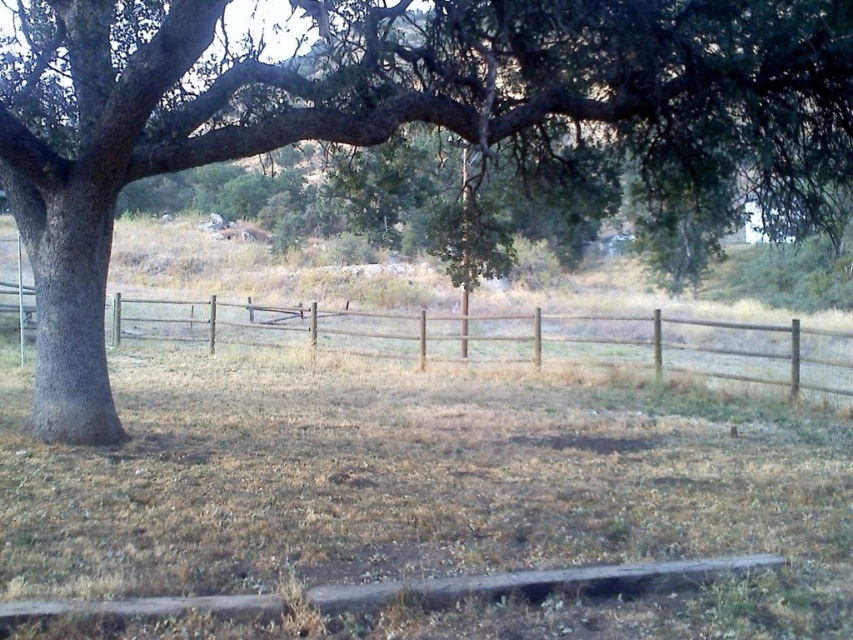
Who is lower down, dry grass at center or brown wooden fence at center?

dry grass at center is lower down.

Does point (126, 502) come in front of point (326, 340)?

Yes.

Between point (207, 404) and point (631, 365), which one is positioned behind?

The point (631, 365) is behind.

This screenshot has height=640, width=853. What are the coordinates of `dry grass at center` in the screenshot? It's located at (425, 497).

Which is in front, point (486, 602) or point (634, 118)?

Point (486, 602) is more forward.

Is dry grass at center below green rough bark tree at left?

Yes, dry grass at center is below green rough bark tree at left.

This screenshot has height=640, width=853. What are the coordinates of `dry grass at center` in the screenshot? It's located at (425, 497).

Identify the location of dry grass at center. (425, 497).

Between green rough bark tree at left and brown wooden fence at center, which one is positioned higher?

Positioned higher is green rough bark tree at left.

Who is more forward, (666,77) or (828,384)?

Point (666,77) is in front.

Locate an element on the screen. green rough bark tree at left is located at coordinates (389, 115).